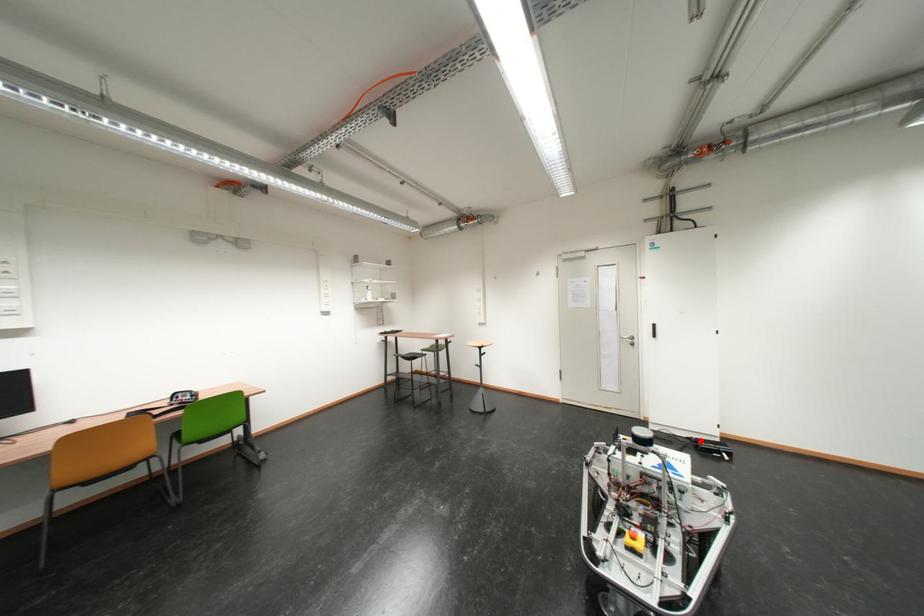
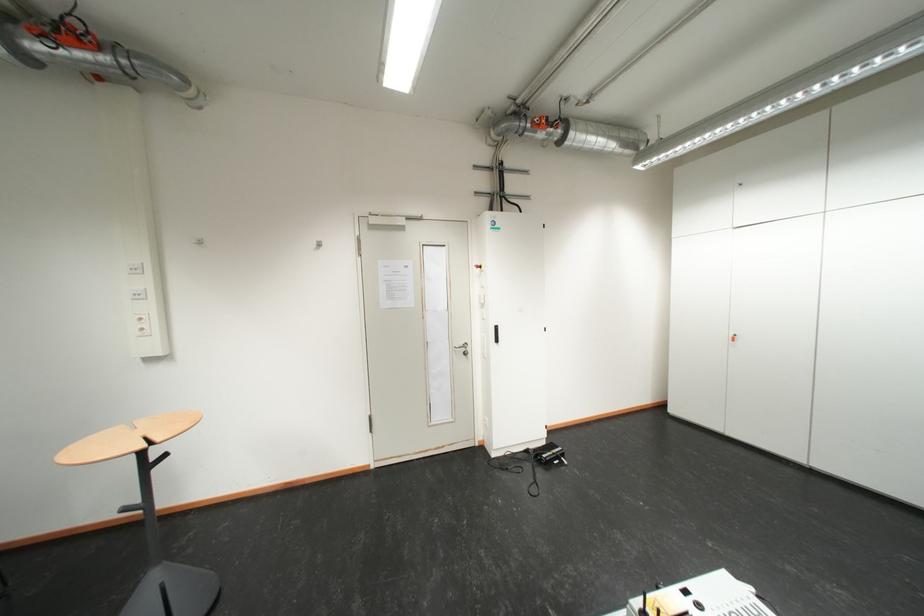
Find the pixel in the second image that matches the highlighted location in the first image.

(538, 454)